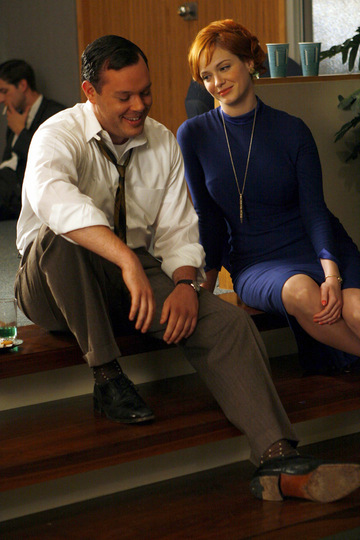
Find the location of a particular element. The width and height of the screenshot is (360, 540). wooden stairs is located at coordinates (228, 484), (76, 447), (58, 355).